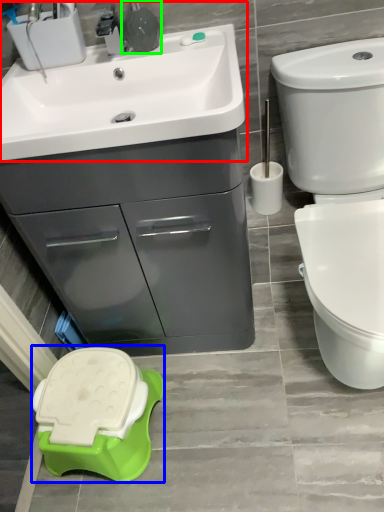
Question: Which object is positioned closest to sink (highlighted by a red box)? Select from porcelain (highlighted by a blue box) and plumbing fixture (highlighted by a green box).

Choices:
 (A) porcelain
 (B) plumbing fixture

Answer: (B)